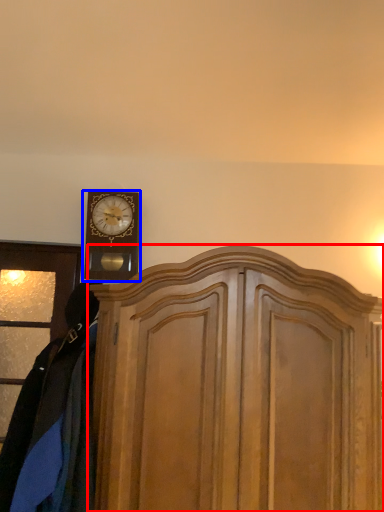
Question: Among these objects, which one is nearest to the camera, dresser (highlighted by a red box) or wall clock (highlighted by a blue box)?

Choices:
 (A) dresser
 (B) wall clock

Answer: (A)